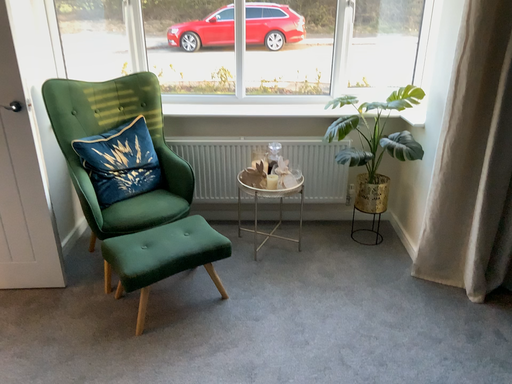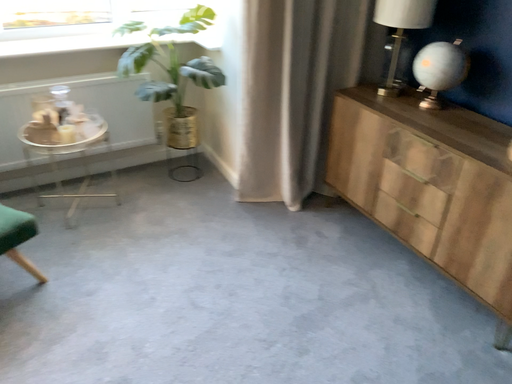
Question: Which way did the camera rotate in the video?

Choices:
 (A) rotated downward
 (B) rotated upward

Answer: (A)